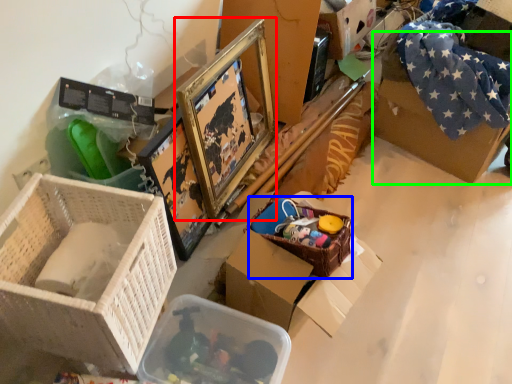
Question: Which object is the closest to the picture frame (highlighted by a red box)? Choose among these: basket (highlighted by a blue box) or cardboard box (highlighted by a green box).

Choices:
 (A) basket
 (B) cardboard box

Answer: (A)